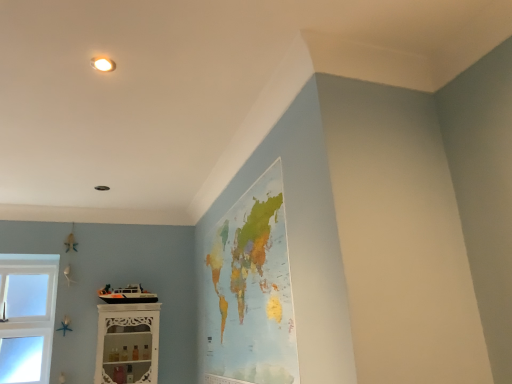
Question: Is white carved wood shelf at lower left taller or shorter than watercolor paper map at upper center?

Choices:
 (A) tall
 (B) short

Answer: (B)

Question: In terms of size, does white carved wood shelf at lower left appear bigger or smaller than watercolor paper map at upper center?

Choices:
 (A) small
 (B) big

Answer: (A)

Question: Considering the positions of white carved wood shelf at lower left and watercolor paper map at upper center in the image, is white carved wood shelf at lower left wider or thinner than watercolor paper map at upper center?

Choices:
 (A) thin
 (B) wide

Answer: (B)

Question: Is watercolor paper map at upper center in front of or behind white carved wood shelf at lower left in the image?

Choices:
 (A) front
 (B) behind

Answer: (A)

Question: Based on their sizes in the image, would you say watercolor paper map at upper center is bigger or smaller than white carved wood shelf at lower left?

Choices:
 (A) small
 (B) big

Answer: (B)

Question: From the image's perspective, is watercolor paper map at upper center located above or below white carved wood shelf at lower left?

Choices:
 (A) above
 (B) below

Answer: (A)

Question: Is watercolor paper map at upper center wider or thinner than white carved wood shelf at lower left?

Choices:
 (A) thin
 (B) wide

Answer: (A)